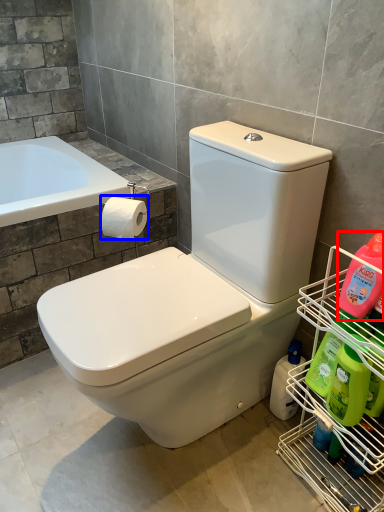
Question: Among these objects, which one is nearest to the camera, cleaning product (highlighted by a red box) or toilet paper (highlighted by a blue box)?

Choices:
 (A) cleaning product
 (B) toilet paper

Answer: (A)